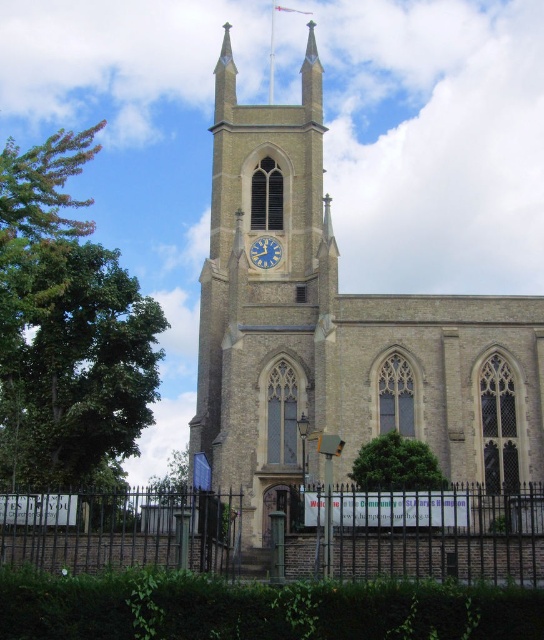
Question: Does beige stone clock tower at center have a larger size compared to black metal fence at lower center?

Choices:
 (A) no
 (B) yes

Answer: (B)

Question: Where is beige stone church at center located in relation to green leafy tree at left in the image?

Choices:
 (A) above
 (B) below

Answer: (A)

Question: Which object appears closest to the camera in this image?

Choices:
 (A) green leafy hedge at lower center
 (B) green leafy tree at center
 (C) black metal fence at lower center

Answer: (A)

Question: Does green leafy hedge at lower center have a larger size compared to green leafy tree at center?

Choices:
 (A) yes
 (B) no

Answer: (A)

Question: Which object appears closest to the camera in this image?

Choices:
 (A) black metal fence at lower center
 (B) beige stone church at center

Answer: (A)

Question: Which object is farther from the camera taking this photo?

Choices:
 (A) beige stone clock tower at center
 (B) green leafy hedge at lower center

Answer: (A)